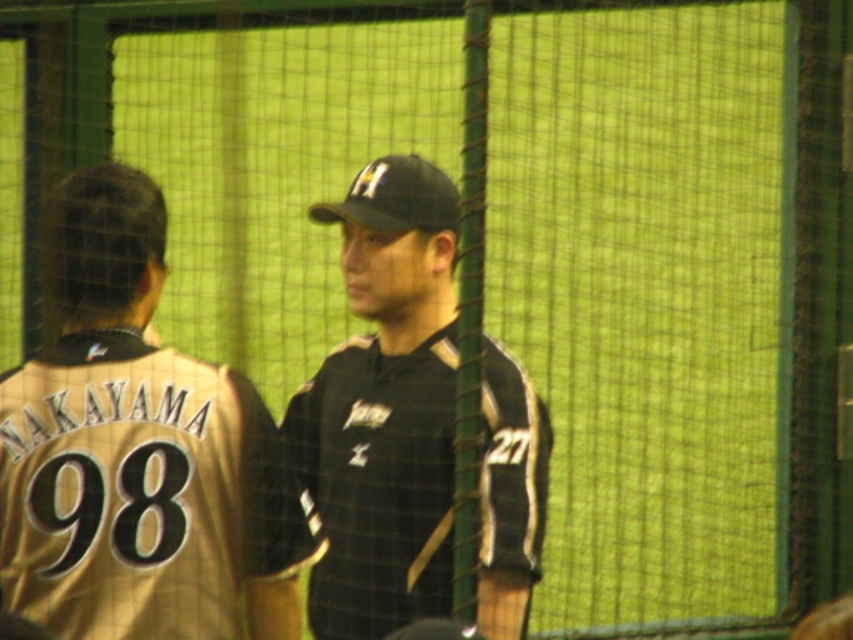
You are a photographer standing at the back of the batting cage. You want to take a photo that includes both the gold jersey at left and the black matte uniform at center. Which of the two should you focus on first to ensure both are in clear focus?

The gold jersey at left is closer to the viewer than the black matte uniform at center. To ensure both are in clear focus, you should focus on the gold jersey at left first since it is closer, and the depth of field will extend to the black matte uniform at center.

You are a photographer standing at the center of the baseball field. You want to take a photo that includes both the point at coordinates point (144, 284) and point (372, 164). Which point should you focus on first to ensure both are in focus?

You should focus on point (144, 284) first because it is closer to the camera than point (372, 164). This ensures that both points will be within the depth of field and in focus.

Consider the image. Where is the gold jersey at left located in the image?

The gold jersey at left is located at point (135, 451).